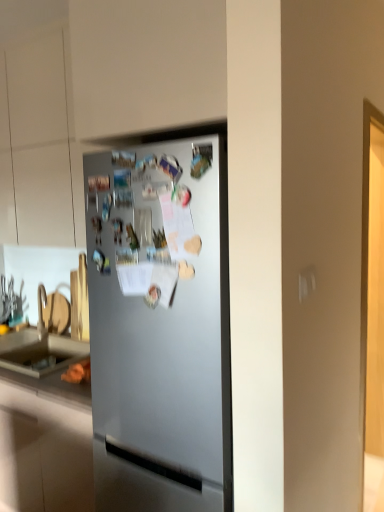
You are a GUI agent. You are given a task and a screenshot of the screen. Output one action in this format:
    pyautogui.click(x=<x>, y=<y>)
    Task: Click on the matte gray countertop at lower left
    
    Given the screenshot: What is the action you would take?
    pyautogui.click(x=44, y=362)

Measure the distance between point (39,350) and camera.

Point (39,350) and camera are 2.55 meters apart.

What do you see at coordinates (44, 362) in the screenshot?
I see `matte gray countertop at lower left` at bounding box center [44, 362].

The height and width of the screenshot is (512, 384). In order to click on satin silver fridge at center in this screenshot , I will do `click(160, 323)`.

What do you see at coordinates (160, 323) in the screenshot? Image resolution: width=384 pixels, height=512 pixels. I see `satin silver fridge at center` at bounding box center [160, 323].

What is the approximate height of satin silver fridge at center?

satin silver fridge at center is 1.83 meters tall.

The width and height of the screenshot is (384, 512). Identify the location of matte gray countertop at lower left. (44, 362).

Can you confirm if satin silver fridge at center is positioned to the left of matte gray countertop at lower left?

Incorrect, satin silver fridge at center is not on the left side of matte gray countertop at lower left.

Is satin silver fridge at center in front of or behind matte gray countertop at lower left in the image?

satin silver fridge at center is positioned closer to the viewer than matte gray countertop at lower left.

Is point (186, 486) closer to camera compared to point (23, 375)?

Yes, it is.

From the image's perspective, is satin silver fridge at center above or below matte gray countertop at lower left?

From the image's perspective, satin silver fridge at center appears above matte gray countertop at lower left.

From a real-world perspective, between satin silver fridge at center and matte gray countertop at lower left, who is vertically lower?

matte gray countertop at lower left is physically lower.

Considering the relative sizes of satin silver fridge at center and matte gray countertop at lower left in the image provided, is satin silver fridge at center thinner than matte gray countertop at lower left?

No.

Can you confirm if satin silver fridge at center is shorter than matte gray countertop at lower left?

No.

Which of these two, satin silver fridge at center or matte gray countertop at lower left, is bigger?

With larger size is satin silver fridge at center.

Could matte gray countertop at lower left be considered to be inside satin silver fridge at center?

No, matte gray countertop at lower left is not surrounded by satin silver fridge at center.

Would you consider satin silver fridge at center to be distant from matte gray countertop at lower left?

satin silver fridge at center is near matte gray countertop at lower left, not far away.

Is satin silver fridge at center aimed at matte gray countertop at lower left?

No.

How many degrees apart are the facing directions of satin silver fridge at center and matte gray countertop at lower left?

The angular difference between satin silver fridge at center and matte gray countertop at lower left is 0.000337 degrees.

Find the location of a particular element. The height and width of the screenshot is (512, 384). counter top that is on the left side of satin silver fridge at center is located at coordinates [44, 362].

Considering the relative positions of matte gray countertop at lower left and satin silver fridge at center in the image provided, is matte gray countertop at lower left to the left of satin silver fridge at center from the viewer's perspective?

Indeed, matte gray countertop at lower left is positioned on the left side of satin silver fridge at center.

Is matte gray countertop at lower left further to camera compared to satin silver fridge at center?

Yes, the depth of matte gray countertop at lower left is greater than that of satin silver fridge at center.

Between point (33, 367) and point (134, 345), which one is positioned in front?

Point (134, 345)

From the image's perspective, relative to satin silver fridge at center, is matte gray countertop at lower left above or below?

matte gray countertop at lower left is below satin silver fridge at center.

Looking at this image, from a real-world perspective, between matte gray countertop at lower left and satin silver fridge at center, who is vertically lower?

In real-world perspective, matte gray countertop at lower left is lower.

Consider the image. Is matte gray countertop at lower left thinner than satin silver fridge at center?

Indeed, matte gray countertop at lower left has a lesser width compared to satin silver fridge at center.

Between matte gray countertop at lower left and satin silver fridge at center, which one has less height?

Standing shorter between the two is matte gray countertop at lower left.

Considering the sizes of objects matte gray countertop at lower left and satin silver fridge at center in the image provided, who is bigger, matte gray countertop at lower left or satin silver fridge at center?

Bigger between the two is satin silver fridge at center.

Is matte gray countertop at lower left located outside satin silver fridge at center?

Absolutely, matte gray countertop at lower left is external to satin silver fridge at center.

Would you say matte gray countertop at lower left is a long distance from satin silver fridge at center?

No, there isn't a large distance between matte gray countertop at lower left and satin silver fridge at center.

Is satin silver fridge at center at the back of matte gray countertop at lower left?

That's not correct — matte gray countertop at lower left is not looking away from satin silver fridge at center.

What's the angular difference between matte gray countertop at lower left and satin silver fridge at center's facing directions?

The angular difference between matte gray countertop at lower left and satin silver fridge at center is 0.000337 degrees.

I want to click on counter top behind the satin silver fridge at center, so click(x=44, y=362).

You are a GUI agent. You are given a task and a screenshot of the screen. Output one action in this format:
    pyautogui.click(x=<x>, y=<y>)
    Task: Click on the counter top below the satin silver fridge at center (from the image's perspective)
    Image resolution: width=384 pixels, height=512 pixels.
    Given the screenshot: What is the action you would take?
    pyautogui.click(x=44, y=362)

Where is `counter top below the satin silver fridge at center (from a real-world perspective)`? The height and width of the screenshot is (512, 384). counter top below the satin silver fridge at center (from a real-world perspective) is located at coordinates (44, 362).